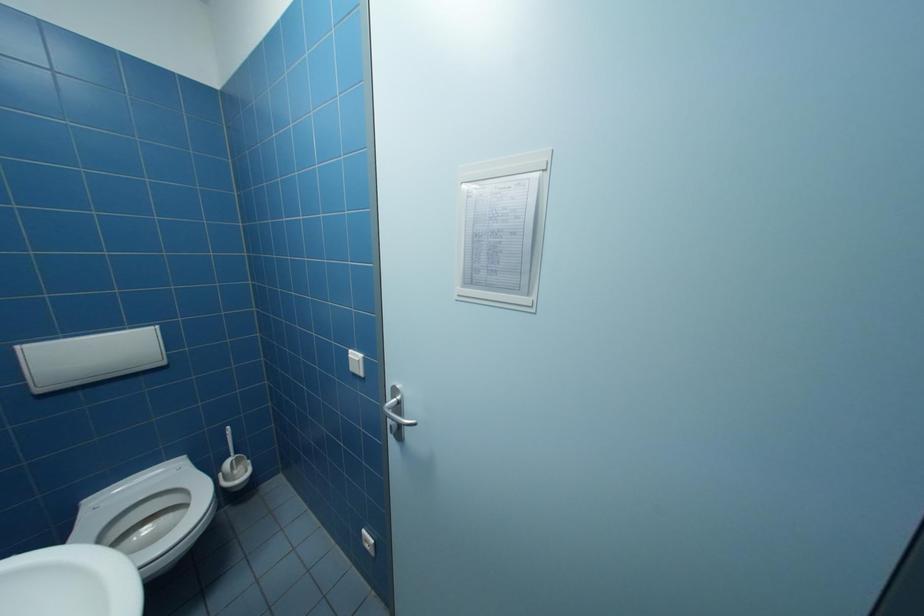
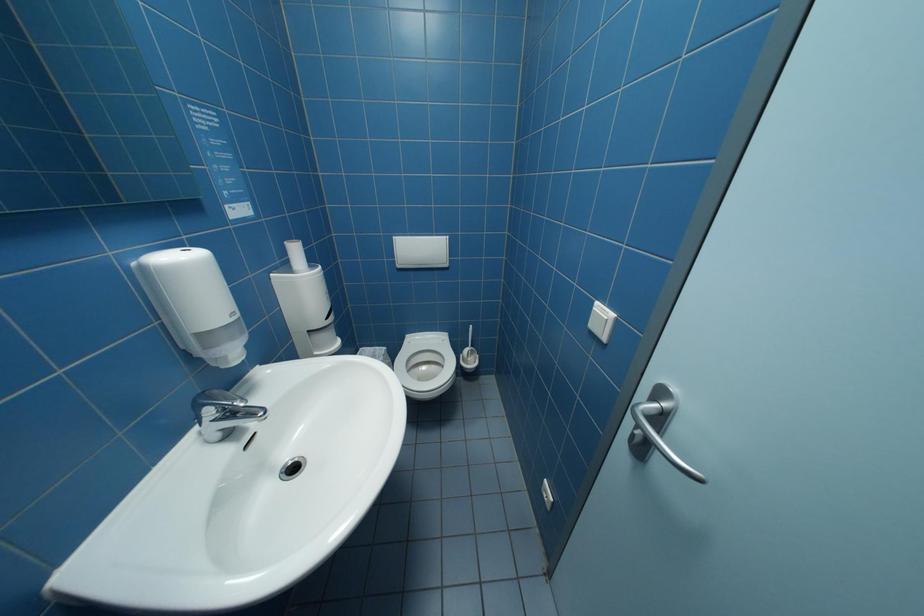
First-person continuous shooting, in which direction is the camera rotating?

The camera rotated toward left-down.